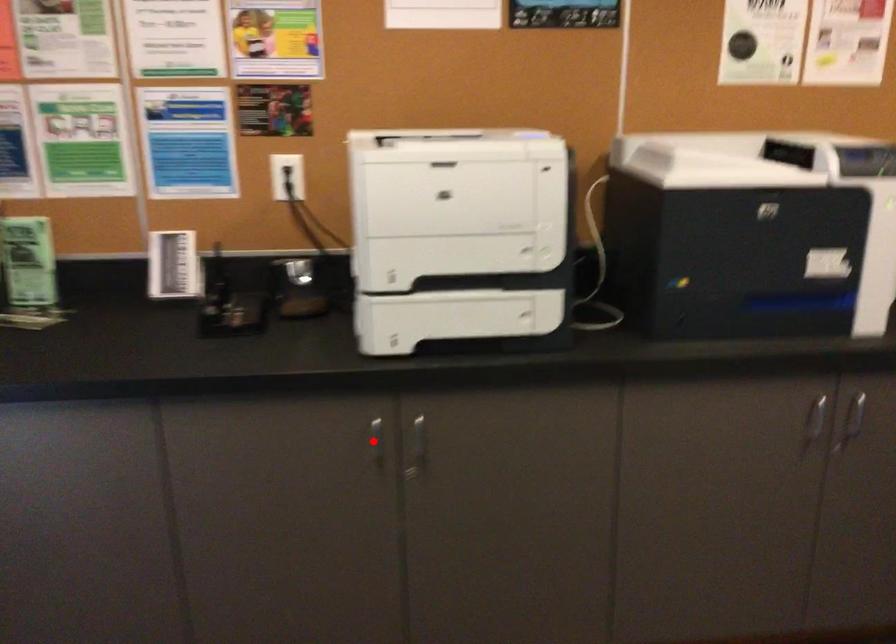
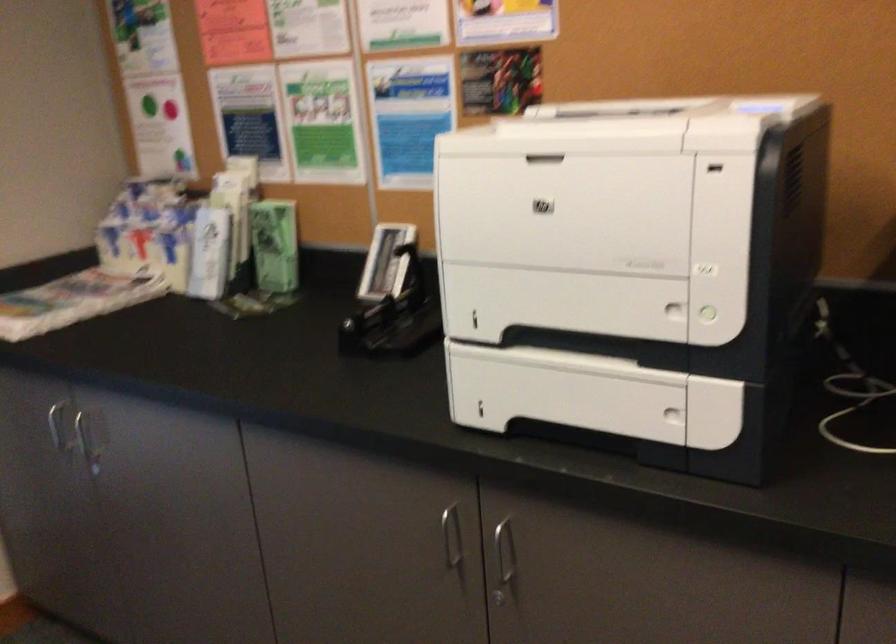
Question: I am providing you with two images of the same scene from different viewpoints. Image1 has a red point marked. In image2, the corresponding 3D location appears at what relative position? Reply with the corresponding letter.

Choices:
 (A) Closer
 (B) Farther

Answer: (A)